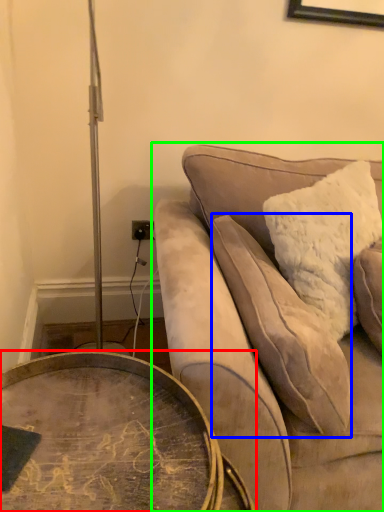
Question: Which is farther away from coffee table (highlighted by a red box)? pillow (highlighted by a blue box) or studio couch (highlighted by a green box)?

Choices:
 (A) pillow
 (B) studio couch

Answer: (A)